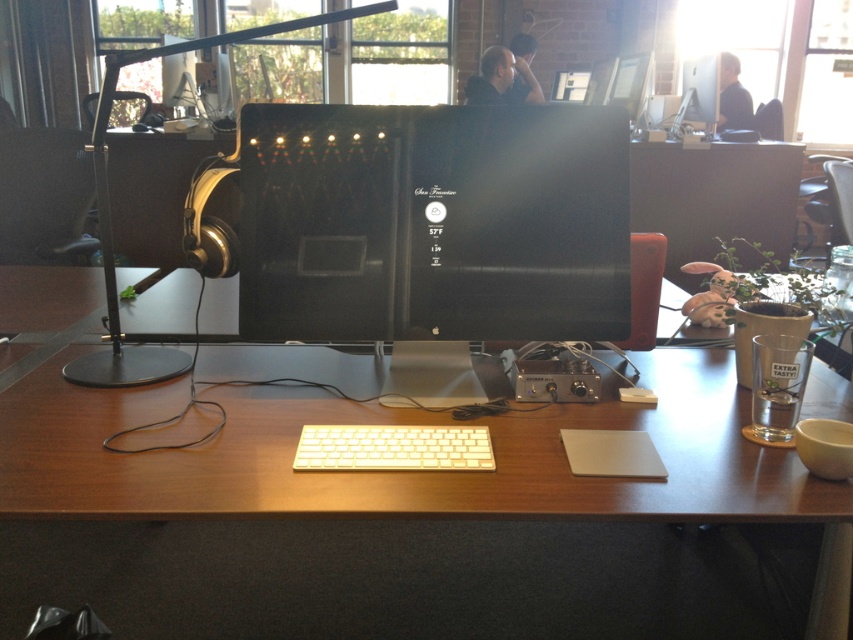
Does wooden at center appear on the left side of white plastic keyboard at center?

Indeed, wooden at center is positioned on the left side of white plastic keyboard at center.

Can you confirm if wooden at center is positioned above white plastic keyboard at center?

Yes.

Which is in front, point (50, 323) or point (451, 465)?

Point (451, 465) is more forward.

Identify the location of wooden at center. The image size is (853, 640). (364, 422).

Is wooden at center bigger than wooden table at center?

Yes.

Is wooden at center to the right of wooden table at center from the viewer's perspective?

No, wooden at center is not to the right of wooden table at center.

Does point (294, 435) come in front of point (672, 253)?

Yes.

Where is `wooden at center`? The image size is (853, 640). wooden at center is located at coordinates (364, 422).

Which of these two, wooden table at center or white plastic keyboard at center, stands shorter?

Standing shorter between the two is white plastic keyboard at center.

From the picture: Between wooden table at center and white plastic keyboard at center, which one appears on the left side from the viewer's perspective?

white plastic keyboard at center

Image resolution: width=853 pixels, height=640 pixels. Describe the element at coordinates (714, 198) in the screenshot. I see `wooden table at center` at that location.

At what (x,y) coordinates should I click in order to perform the action: click on wooden table at center. Please return your answer as a coordinate pair (x, y). This screenshot has height=640, width=853. Looking at the image, I should click on (714, 198).